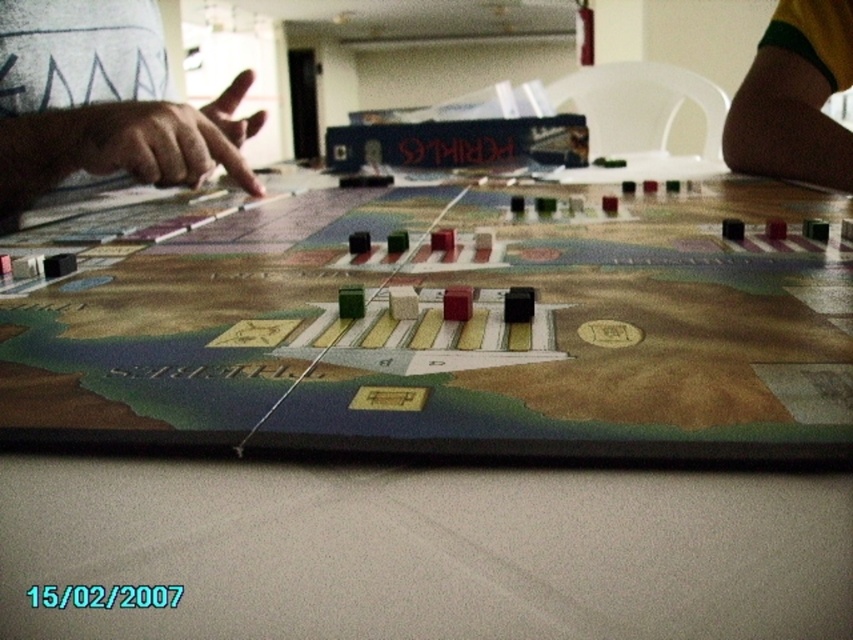
You are playing a board game and want to place your token near the hand pointing at the board. Where should you place your token to be closest to the skinny white hand at upper left?

You should place your token at point (103, 102) to be closest to the skinny white hand at upper left since that is its 2D location.

You are a player in the board game and need to place your token near the hand pointing at the section. Which object is closer to the edge of the board? The skinny white hand at upper left or the brown fabric pants at lower right?

The brown fabric pants at lower right is closer to the edge of the board because the skinny white hand at upper left is larger in size than it, implying it might be farther away.

You are playing a board game and notice a skinny white hand at upper left and brown fabric pants at lower right. Which object is positioned more to the left side of the image?

The skinny white hand at upper left is positioned more to the left side of the image than the brown fabric pants at lower right.